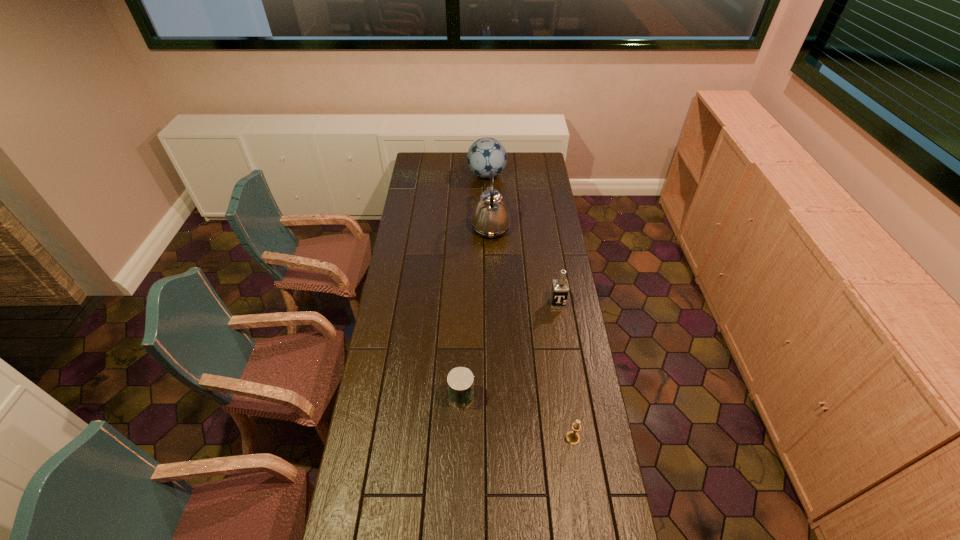
At what (x,y) coordinates should I click in order to perform the action: click on vacant space that satisfies the following two spatial constraints: 1. on the side with brand of the farthest object; 2. on the front side of the can. Please return your answer as a coordinate pair (x, y). The height and width of the screenshot is (540, 960). Looking at the image, I should click on (491, 397).

Find the location of a particular element. The height and width of the screenshot is (540, 960). free spot that satisfies the following two spatial constraints: 1. from the spout of the nearest object; 2. on the right side of the kettle is located at coordinates (496, 438).